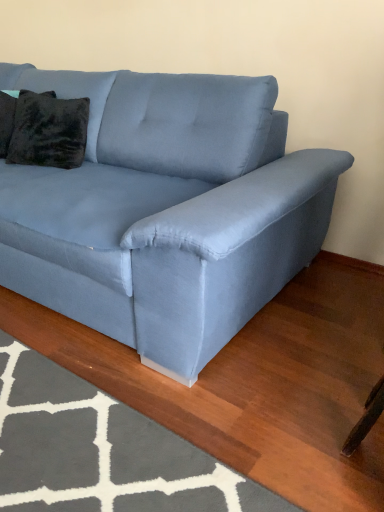
Question: Does gray textured rug at lower left have a larger size compared to velvet dark brown pillow at upper left, the 1th pillow when ordered from right to left?

Choices:
 (A) yes
 (B) no

Answer: (B)

Question: From the image's perspective, is gray textured rug at lower left on velvet dark brown pillow at upper left, the 1th pillow when ordered from right to left?

Choices:
 (A) yes
 (B) no

Answer: (B)

Question: Is gray textured rug at lower left positioned with its back to velvet dark brown pillow at upper left, the 1th pillow when ordered from right to left?

Choices:
 (A) yes
 (B) no

Answer: (B)

Question: Can you confirm if gray textured rug at lower left is thinner than velvet dark brown pillow at upper left, which is counted as the 2th pillow, starting from the left?

Choices:
 (A) no
 (B) yes

Answer: (A)

Question: Is gray textured rug at lower left located outside velvet dark brown pillow at upper left, the 1th pillow when ordered from right to left?

Choices:
 (A) no
 (B) yes

Answer: (B)

Question: From the image's perspective, is light blue fabric couch at center located above or below gray textured rug at lower left?

Choices:
 (A) above
 (B) below

Answer: (A)

Question: Relative to gray textured rug at lower left, is light blue fabric couch at center in front or behind?

Choices:
 (A) front
 (B) behind

Answer: (B)

Question: Is point (155, 187) positioned closer to the camera than point (99, 492)?

Choices:
 (A) closer
 (B) farther

Answer: (B)

Question: Choose the correct answer: Is light blue fabric couch at center inside gray textured rug at lower left or outside it?

Choices:
 (A) outside
 (B) inside

Answer: (A)

Question: Looking at their shapes, would you say velvety black pillow at upper left, which is the second pillow from right to left, is wider or thinner than light blue fabric couch at center?

Choices:
 (A) thin
 (B) wide

Answer: (A)

Question: Considering the positions of velvety black pillow at upper left, which is the second pillow from right to left, and light blue fabric couch at center in the image, is velvety black pillow at upper left, which is the second pillow from right to left, bigger or smaller than light blue fabric couch at center?

Choices:
 (A) big
 (B) small

Answer: (B)

Question: From a real-world perspective, is velvety black pillow at upper left, which is the second pillow from right to left, positioned above or below light blue fabric couch at center?

Choices:
 (A) below
 (B) above

Answer: (B)

Question: From the image's perspective, is velvety black pillow at upper left, which is the second pillow from right to left, above or below light blue fabric couch at center?

Choices:
 (A) below
 (B) above

Answer: (B)

Question: Is light blue fabric couch at center wider or thinner than velvety black pillow at upper left, which is the second pillow from right to left?

Choices:
 (A) thin
 (B) wide

Answer: (B)

Question: Is point (147, 182) closer or farther from the camera than point (0, 101)?

Choices:
 (A) farther
 (B) closer

Answer: (B)